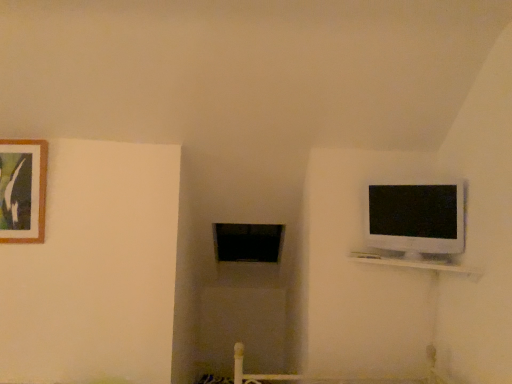
Question: Is wooden picture frame at upper left inside the boundaries of white glossy shelf at upper right, or outside?

Choices:
 (A) outside
 (B) inside

Answer: (A)

Question: Looking at the image, does wooden picture frame at upper left seem bigger or smaller compared to white glossy shelf at upper right?

Choices:
 (A) small
 (B) big

Answer: (A)

Question: Which of these objects is positioned farthest from the white glossy television at upper right?

Choices:
 (A) white glossy shelf at upper right
 (B) wooden picture frame at upper left

Answer: (B)

Question: Considering the real-world distances, which object is farthest from the white glossy shelf at upper right?

Choices:
 (A) wooden picture frame at upper left
 (B) white glossy television at upper right

Answer: (A)